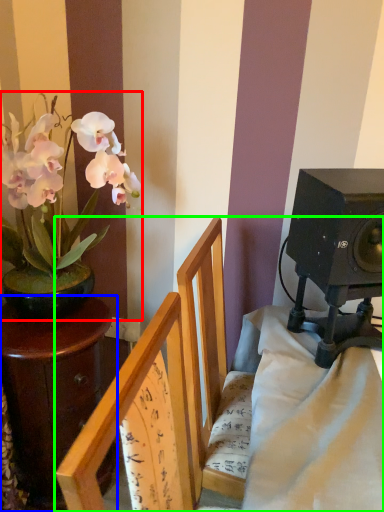
Question: Based on their relative distances, which object is farther from houseplant (highlighted by a red box)? Choose from table (highlighted by a blue box) and furniture (highlighted by a green box).

Choices:
 (A) table
 (B) furniture

Answer: (B)